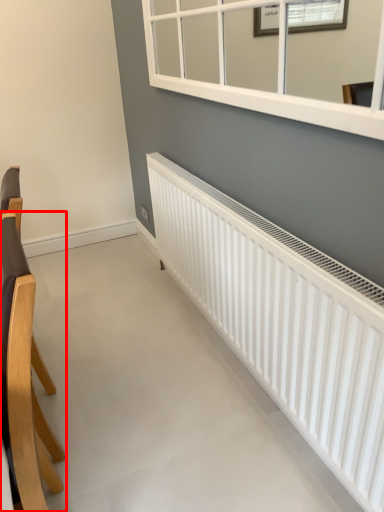
Question: From the image's perspective, where is chair (annotated by the red box) located in relation to radiator in the image?

Choices:
 (A) above
 (B) below

Answer: (B)